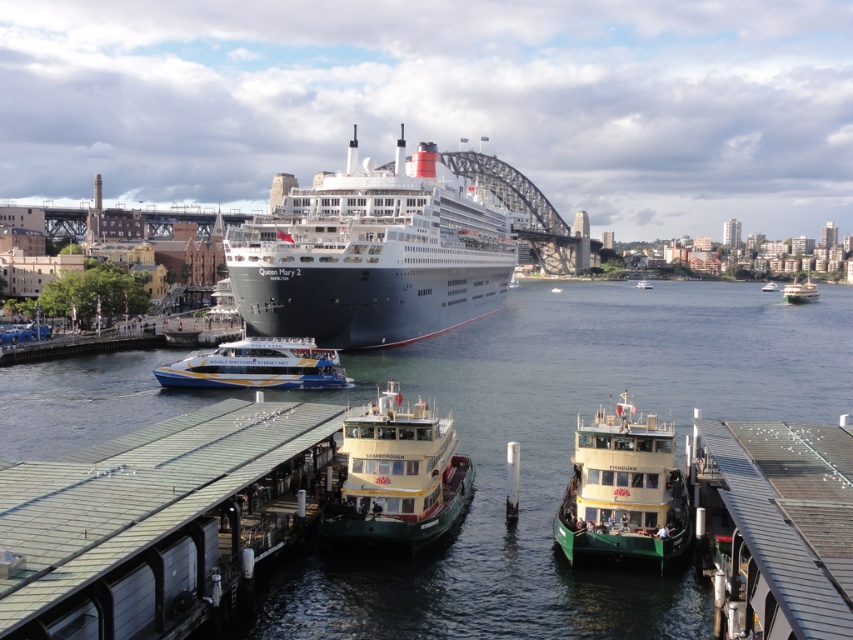
You are a tour guide standing on the pier and want to point out the distance between the blue and yellow painted ferry at center and the white glossy ferry at center to your tourists. How far apart are they?

The blue and yellow painted ferry at center is 260.48 meters from white glossy ferry at center.